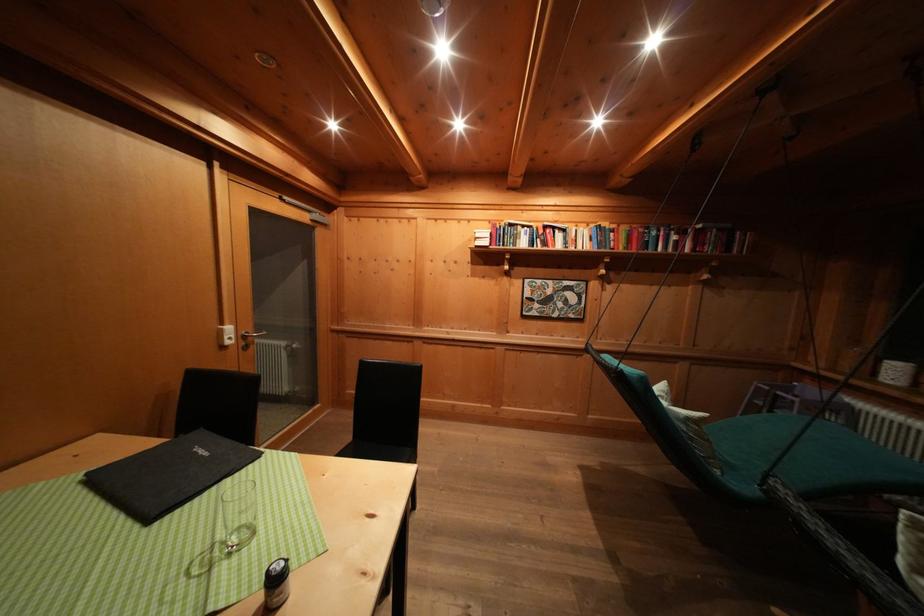
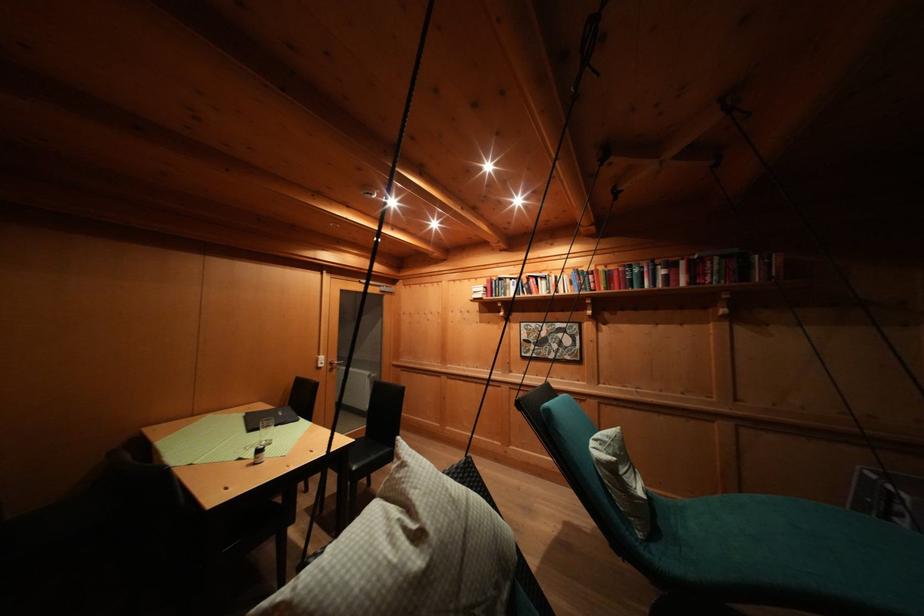
The point at (x=159, y=448) is marked in the first image. Where is the corresponding point in the second image?

(275, 411)